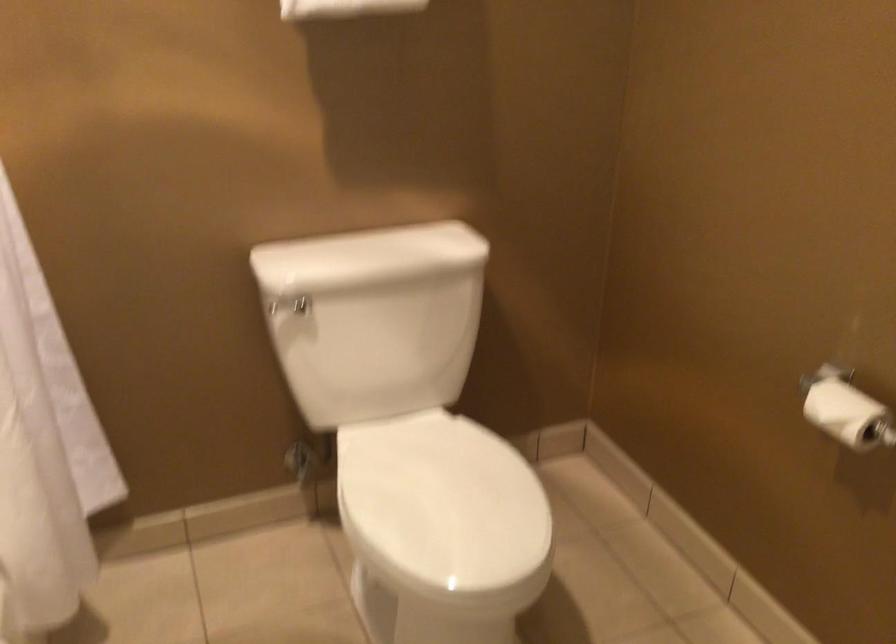
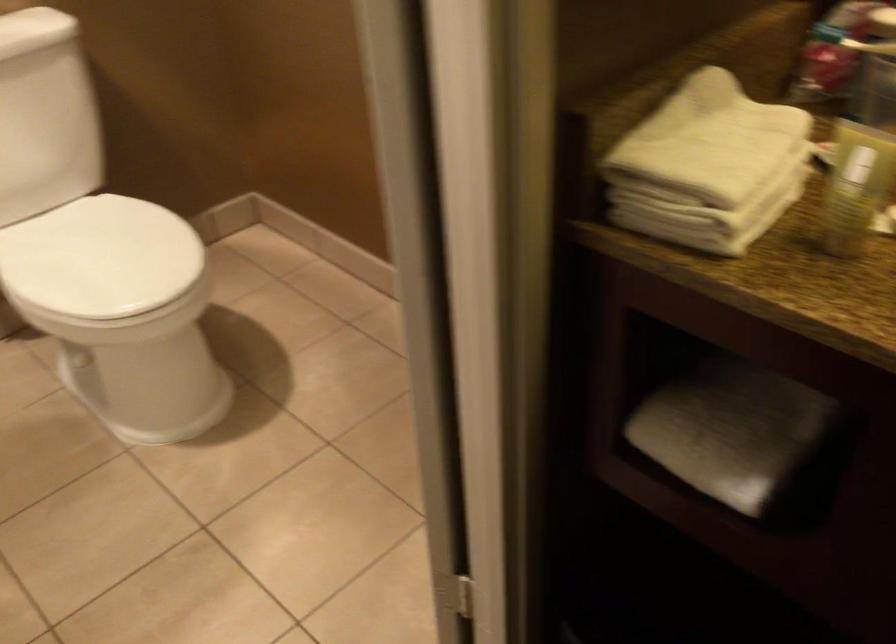
In the second image, find the point that corresponds to (441,504) in the first image.

(99, 257)